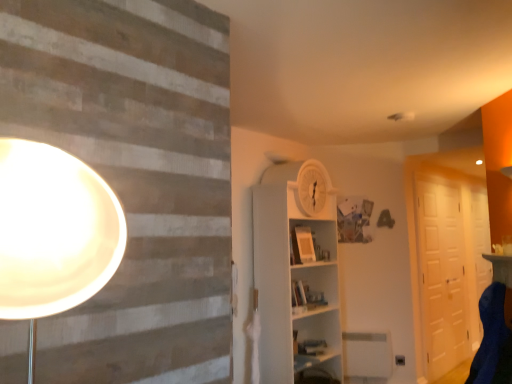
Question: Does white matte barn door at right turn towards white glossy door at right?

Choices:
 (A) no
 (B) yes

Answer: (A)

Question: Is white matte barn door at right thinner than white glossy door at right?

Choices:
 (A) no
 (B) yes

Answer: (A)

Question: From the image's perspective, is white matte barn door at right below white glossy door at right?

Choices:
 (A) no
 (B) yes

Answer: (A)

Question: From the image's perspective, does white matte barn door at right appear higher than white glossy door at right?

Choices:
 (A) no
 (B) yes

Answer: (B)

Question: Considering the relative positions of white matte barn door at right and white glossy door at right in the image provided, is white matte barn door at right in front of white glossy door at right?

Choices:
 (A) no
 (B) yes

Answer: (B)

Question: Relative to matte white table at right, is white glossy door at right in front or behind?

Choices:
 (A) behind
 (B) front

Answer: (A)

Question: From their relative heights in the image, would you say white glossy door at right is taller or shorter than matte white table at right?

Choices:
 (A) tall
 (B) short

Answer: (A)

Question: Is point (479, 266) positioned closer to the camera than point (498, 256)?

Choices:
 (A) farther
 (B) closer

Answer: (A)

Question: From a real-world perspective, is white glossy door at right physically located above or below matte white table at right?

Choices:
 (A) below
 (B) above

Answer: (A)

Question: In terms of width, does white glossy door at right look wider or thinner when compared to blue fabric swivel chair at lower right?

Choices:
 (A) thin
 (B) wide

Answer: (A)

Question: From a real-world perspective, is white glossy door at right above or below blue fabric swivel chair at lower right?

Choices:
 (A) below
 (B) above

Answer: (B)

Question: From the image's perspective, relative to blue fabric swivel chair at lower right, is white glossy door at right above or below?

Choices:
 (A) above
 (B) below

Answer: (B)

Question: Looking at the image, does white glossy door at right seem bigger or smaller compared to blue fabric swivel chair at lower right?

Choices:
 (A) small
 (B) big

Answer: (B)

Question: From a real-world perspective, is matte white table at right above or below blue fabric swivel chair at lower right?

Choices:
 (A) above
 (B) below

Answer: (A)

Question: Based on their positions, is matte white table at right located to the left or right of blue fabric swivel chair at lower right?

Choices:
 (A) left
 (B) right

Answer: (B)